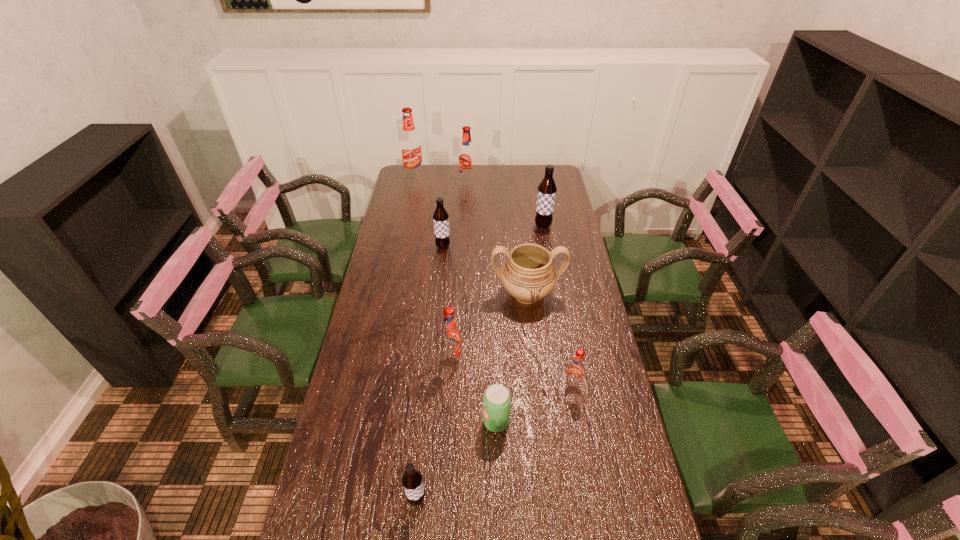
Locate an element on the screen. free space between the second biggest red root beer and the third farthest red root beer is located at coordinates (460, 271).

Identify which object is the closest to the urn. Please provide its 2D coordinates. Your answer should be formatted as a tuple, i.e. [(x, y)], where the tuple contains the x and y coordinates of a point satisfying the conditions above.

[(451, 346)]

Identify which object is the closest to the eighth farthest object. Please provide its 2D coordinates. Your answer should be formatted as a tuple, i.e. [(x, y)], where the tuple contains the x and y coordinates of a point satisfying the conditions above.

[(451, 346)]

Locate an element on the screen. the fifth closest root beer to the third smallest red root beer is located at coordinates (576, 370).

Locate an element on the screen. The height and width of the screenshot is (540, 960). root beer that is the second closest to the second smallest red root beer is located at coordinates (412, 481).

Identify which red root beer is located as the fourth nearest to the second smallest brown root beer. Please provide its 2D coordinates. Your answer should be formatted as a tuple, i.e. [(x, y)], where the tuple contains the x and y coordinates of a point satisfying the conditions above.

[(576, 370)]

At what (x,y) coordinates should I click in order to perform the action: click on red root beer that is the third nearest to the third farthest red root beer. Please return your answer as a coordinate pair (x, y). The height and width of the screenshot is (540, 960). Looking at the image, I should click on (410, 143).

Select which brown root beer appears as the closest to the third farthest red root beer. Please provide its 2D coordinates. Your answer should be formatted as a tuple, i.e. [(x, y)], where the tuple contains the x and y coordinates of a point satisfying the conditions above.

[(412, 481)]

Choose which brown root beer is the second nearest neighbor to the sixth farthest object. Please provide its 2D coordinates. Your answer should be formatted as a tuple, i.e. [(x, y)], where the tuple contains the x and y coordinates of a point satisfying the conditions above.

[(440, 216)]

Locate an element on the screen. This screenshot has width=960, height=540. vacant space that satisfies the following two spatial constraints: 1. on the back side of the fifth nearest root beer; 2. on the right side of the sixth farthest object is located at coordinates (460, 226).